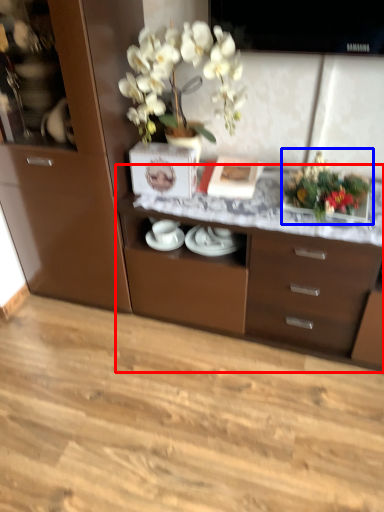
Question: Which of the following is the closest to the observer, desk (highlighted by a red box) or floral arrangement (highlighted by a blue box)?

Choices:
 (A) desk
 (B) floral arrangement

Answer: (A)